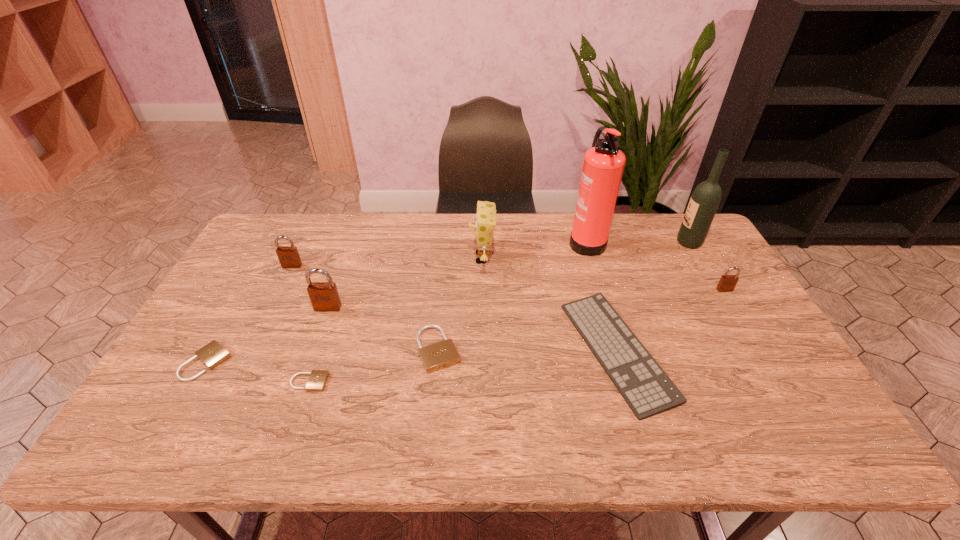
Locate an element on the screen. The width and height of the screenshot is (960, 540). padlock present at the right edge is located at coordinates (727, 283).

Locate an element on the screen. The height and width of the screenshot is (540, 960). object that is at the far right corner is located at coordinates (704, 202).

This screenshot has height=540, width=960. I want to click on vacant space at the far edge of the desktop, so click(x=448, y=251).

Where is `vacant area at the near edge`? This screenshot has height=540, width=960. vacant area at the near edge is located at coordinates (x=606, y=428).

At what (x,y) coordinates should I click in order to perform the action: click on free spot at the left edge of the desktop. Please return your answer as a coordinate pair (x, y). The height and width of the screenshot is (540, 960). Looking at the image, I should click on (203, 322).

In the image, there is a desktop. In order to click on blank space at the right edge in this screenshot , I will do 686,268.

The width and height of the screenshot is (960, 540). In order to click on vacant space at the far right corner in this screenshot , I will do `click(706, 251)`.

Locate an element on the screen. The width and height of the screenshot is (960, 540). free space between the shortest object and the biggest brown padlock is located at coordinates (319, 345).

Where is `vacant area that lies between the red fire extinguisher and the sixth object from right to left`? The height and width of the screenshot is (540, 960). vacant area that lies between the red fire extinguisher and the sixth object from right to left is located at coordinates (512, 295).

Locate an element on the screen. The width and height of the screenshot is (960, 540). empty space that is in between the sixth object from left to right and the smallest beige padlock is located at coordinates (396, 320).